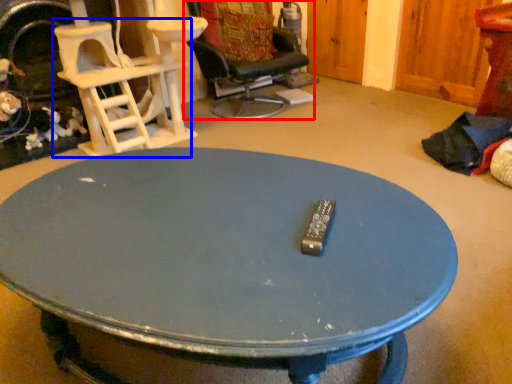
Question: Among these objects, which one is farthest to the camera, chair (highlighted by a red box) or chair (highlighted by a blue box)?

Choices:
 (A) chair
 (B) chair

Answer: (A)